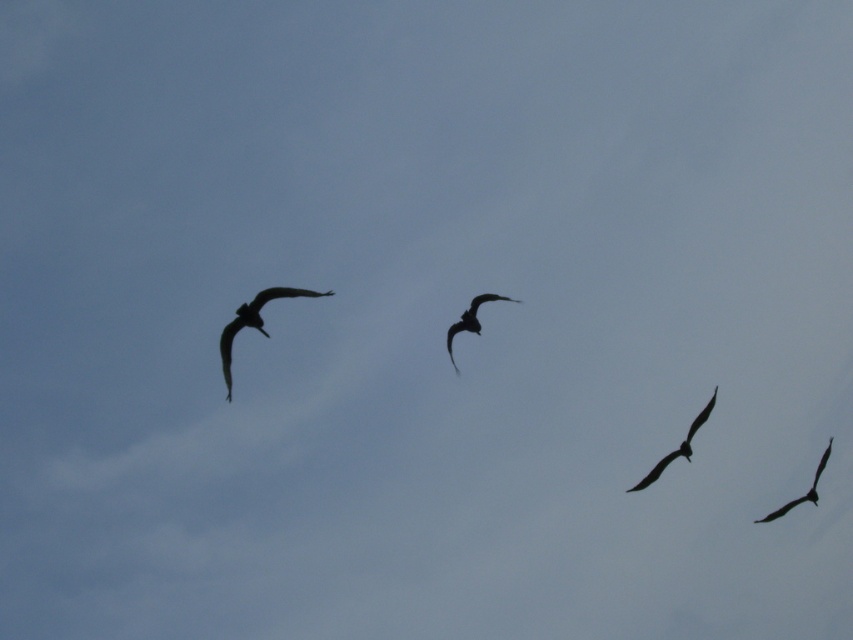
You are a birdwatcher trying to capture both the black matte bird at lower right and the silhouette feathered bird at lower right in a single photo. Given that your camera has a maximum focus range of 5 meters, can you fit both birds into the frame without moving the camera?

The black matte bird at lower right and the silhouette feathered bird at lower right are 7.21 meters apart, which exceeds the camera maximum focus range of 5 meters. Therefore, you cannot fit both birds into the frame without moving the camera.

You are an ornithologist observing the birds in the image. You notice two birds at the lower right corner. Which one is positioned higher in the sky between the black matte bird at lower right and the silhouette feathered bird at lower right?

The black matte bird at lower right is positioned higher in the sky than the silhouette feathered bird at lower right because it is located above it.